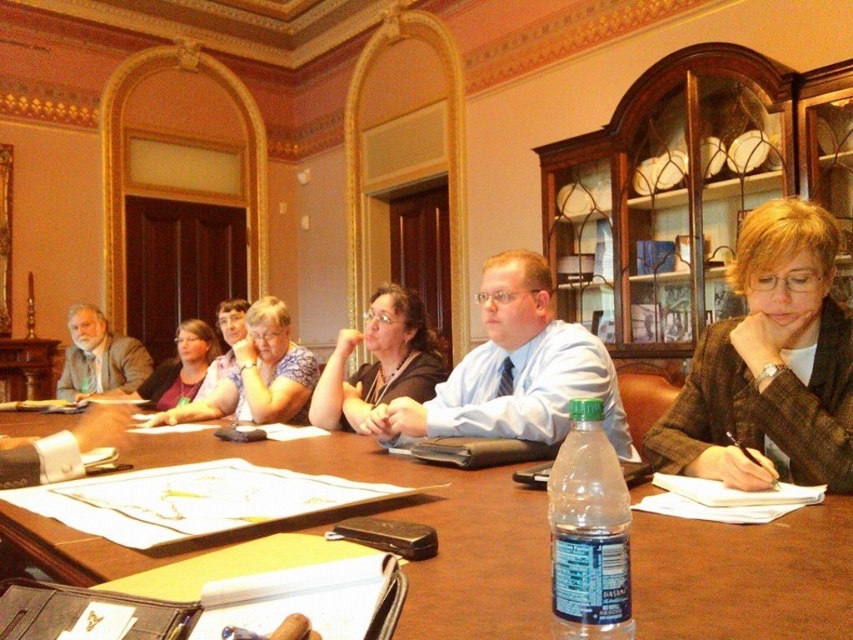
Who is more forward, (808, 369) or (413, 371)?

Point (808, 369) is more forward.

How far apart are plaid wool blazer at center and matte black shirt at center?

They are 1.07 meters apart.

Between point (845, 401) and point (401, 339), which one is positioned behind?

Positioned behind is point (401, 339).

Image resolution: width=853 pixels, height=640 pixels. I want to click on plaid wool blazer at center, so click(x=769, y=365).

Is the position of brown wooden table at center more distant than that of plaid wool blazer at center?

That is False.

Measure the distance between brown wooden table at center and camera.

They are 66.68 centimeters apart.

Does point (26, 528) come in front of point (712, 346)?

Yes, point (26, 528) is closer to viewer.

I want to click on brown wooden table at center, so click(422, 522).

Does brown wooden table at center appear over matte black shirt at center?

Actually, brown wooden table at center is below matte black shirt at center.

Is brown wooden table at center closer to camera compared to matte black shirt at center?

Yes, it is.

Which is behind, point (787, 616) or point (376, 305)?

The point (376, 305) is behind.

Find the location of a particular element. brown wooden table at center is located at coordinates (422, 522).